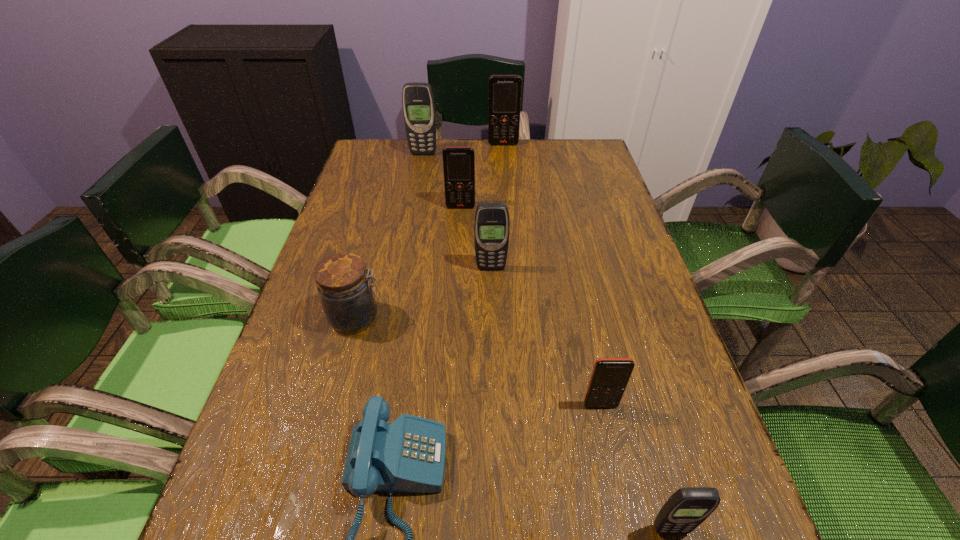
Identify the location of the seventh object from left to right. (610, 376).

I want to click on the rightmost cellular telephone, so click(687, 508).

At what (x,y) coordinates should I click in order to perform the action: click on the rightmost gray cellular telephone. Please return your answer as a coordinate pair (x, y). The image size is (960, 540). Looking at the image, I should click on (687, 508).

You are a GUI agent. You are given a task and a screenshot of the screen. Output one action in this format:
    pyautogui.click(x=<x>, y=<y>)
    Task: Click on the free region located 0.130m on the screen of the farthest cellular telephone
    This screenshot has width=960, height=540.
    Given the screenshot: What is the action you would take?
    coord(505,166)

You are a GUI agent. You are given a task and a screenshot of the screen. Output one action in this format:
    pyautogui.click(x=<x>, y=<y>)
    Task: Click on the vacant space located on the screen of the second farthest cellular telephone
    The height and width of the screenshot is (540, 960).
    Given the screenshot: What is the action you would take?
    pyautogui.click(x=411, y=221)

The height and width of the screenshot is (540, 960). In order to click on free location located 0.270m on the screen of the fourth farthest cellular telephone in this screenshot , I will do `click(493, 368)`.

Where is `vacant area situated 0.370m on the screen of the second farthest orange cellular telephone`? Image resolution: width=960 pixels, height=540 pixels. vacant area situated 0.370m on the screen of the second farthest orange cellular telephone is located at coordinates (455, 310).

At what (x,y) coordinates should I click in order to perform the action: click on free space located 0.050m on the lid of the jar. Please return your answer as a coordinate pair (x, y). This screenshot has height=540, width=960. Looking at the image, I should click on (408, 318).

Locate an element on the screen. Image resolution: width=960 pixels, height=540 pixels. free space located 0.160m on the screen of the second object from right to left is located at coordinates (622, 506).

Locate an element on the screen. This screenshot has height=540, width=960. cellular telephone that is at the left edge is located at coordinates (418, 103).